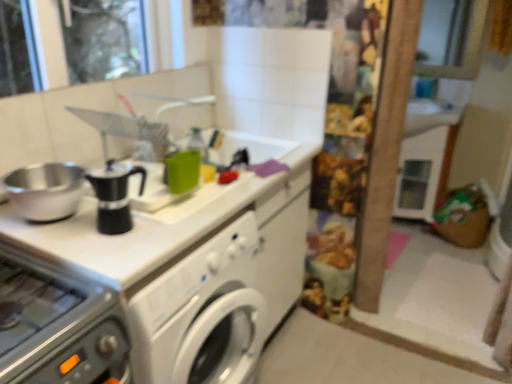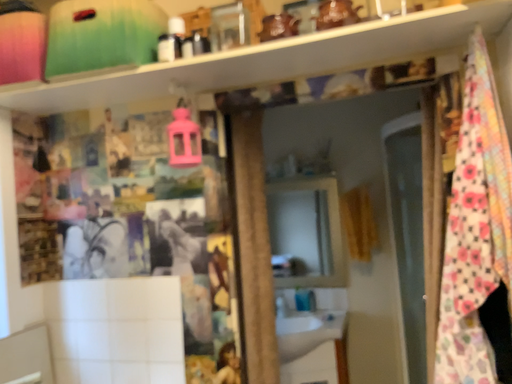
Question: Which way did the camera rotate in the video?

Choices:
 (A) rotated right
 (B) rotated left

Answer: (A)